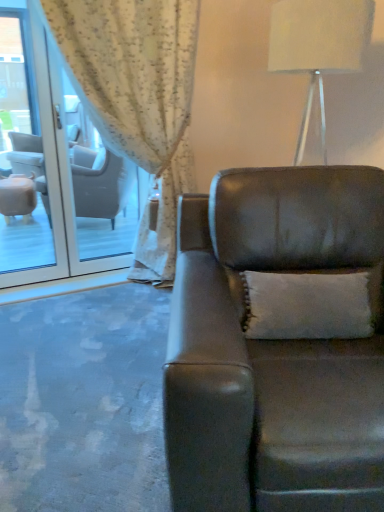
Question: Considering the relative sizes of white textured curtain at upper left and clear glass door at left in the image provided, is white textured curtain at upper left shorter than clear glass door at left?

Choices:
 (A) no
 (B) yes

Answer: (A)

Question: Is white textured curtain at upper left turned away from clear glass door at left?

Choices:
 (A) yes
 (B) no

Answer: (A)

Question: Is the position of white textured curtain at upper left more distant than that of clear glass door at left?

Choices:
 (A) no
 (B) yes

Answer: (A)

Question: Considering the relative sizes of white textured curtain at upper left and clear glass door at left in the image provided, is white textured curtain at upper left taller than clear glass door at left?

Choices:
 (A) no
 (B) yes

Answer: (B)

Question: Does white textured curtain at upper left have a larger size compared to clear glass door at left?

Choices:
 (A) no
 (B) yes

Answer: (B)

Question: Considering the positions of white fabric lampshade at upper right and leather couch at center in the image, is white fabric lampshade at upper right bigger or smaller than leather couch at center?

Choices:
 (A) small
 (B) big

Answer: (A)

Question: Based on their positions, is white fabric lampshade at upper right located to the left or right of leather couch at center?

Choices:
 (A) left
 (B) right

Answer: (B)

Question: From their relative heights in the image, would you say white fabric lampshade at upper right is taller or shorter than leather couch at center?

Choices:
 (A) tall
 (B) short

Answer: (B)

Question: From the image's perspective, is white fabric lampshade at upper right located above or below leather couch at center?

Choices:
 (A) below
 (B) above

Answer: (B)

Question: Is point (365, 339) closer or farther from the camera than point (319, 42)?

Choices:
 (A) farther
 (B) closer

Answer: (B)

Question: Is leather couch at center inside the boundaries of white fabric lampshade at upper right, or outside?

Choices:
 (A) inside
 (B) outside

Answer: (B)

Question: Is leather couch at center taller or shorter than white fabric lampshade at upper right?

Choices:
 (A) short
 (B) tall

Answer: (B)

Question: Visually, is leather couch at center positioned to the left or to the right of white fabric lampshade at upper right?

Choices:
 (A) left
 (B) right

Answer: (A)

Question: Based on their positions, is white textured pillow at center located to the left or right of white fabric lampshade at upper right?

Choices:
 (A) right
 (B) left

Answer: (B)

Question: Is white textured pillow at center in front of or behind white fabric lampshade at upper right in the image?

Choices:
 (A) front
 (B) behind

Answer: (A)